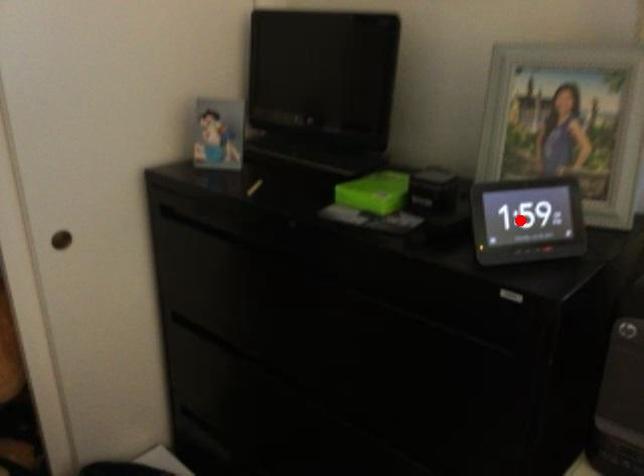
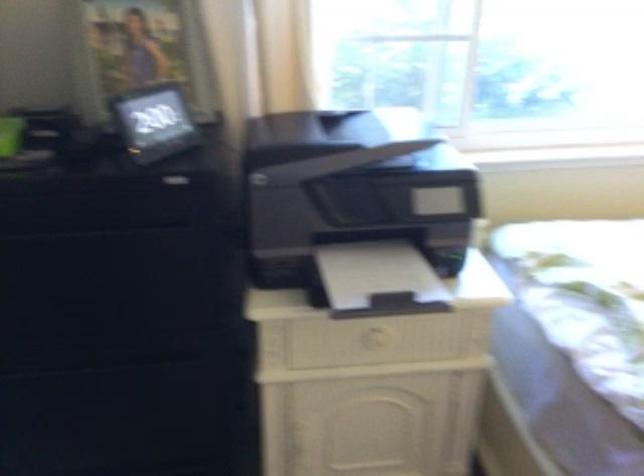
Find the pixel in the second image that matches the highlighted location in the first image.

(154, 122)